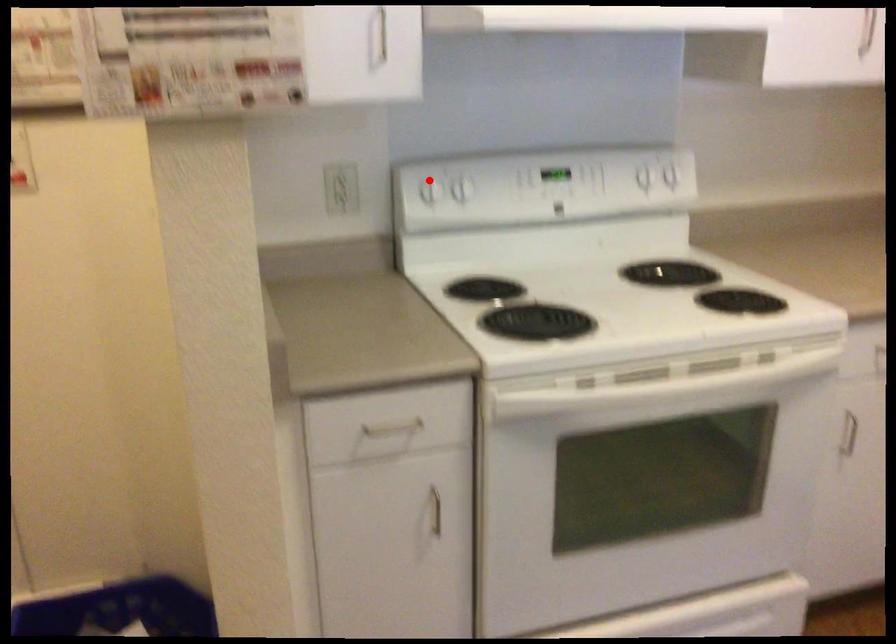
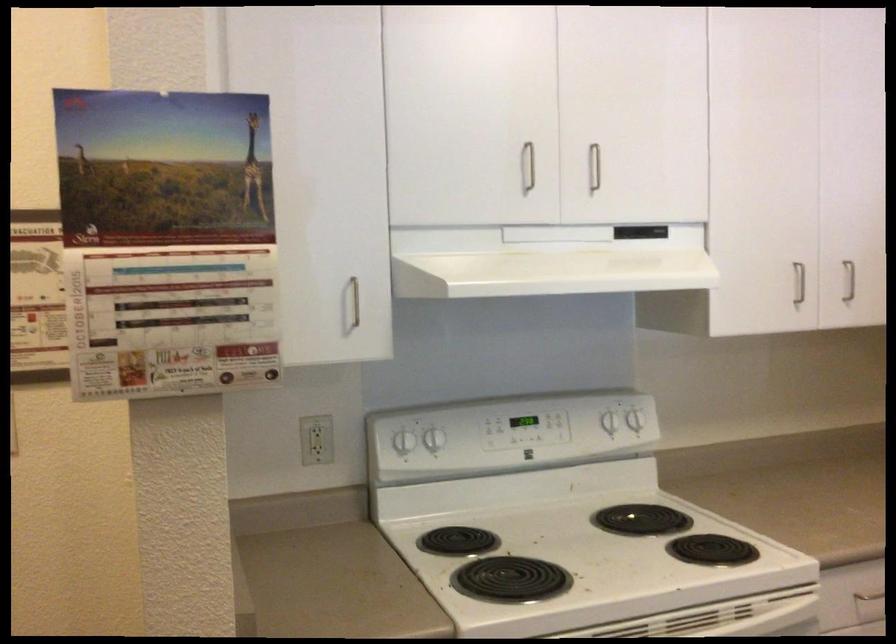
Locate, in the second image, the point that corresponds to the highlighted location in the first image.

(400, 433)